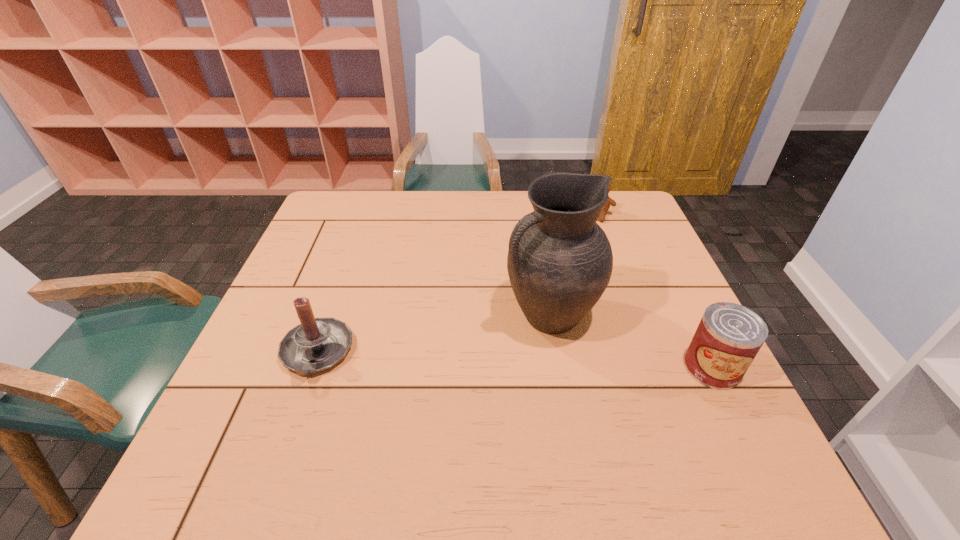
Locate an element on the screen. This screenshot has height=540, width=960. free spot between the farthest object and the rightmost object is located at coordinates (655, 292).

Find the location of `free point between the candle and the pitcher`. free point between the candle and the pitcher is located at coordinates (434, 334).

In order to click on vacant space in between the candle and the pitcher in this screenshot , I will do `click(434, 334)`.

Locate an element on the screen. This screenshot has width=960, height=540. vacant point located between the can and the shortest object is located at coordinates (655, 292).

Locate an element on the screen. The image size is (960, 540). object that stands as the third closest to the third object from left to right is located at coordinates (316, 344).

Point out which object is positioned as the nearest to the candle. Please provide its 2D coordinates. Your answer should be formatted as a tuple, i.e. [(x, y)], where the tuple contains the x and y coordinates of a point satisfying the conditions above.

[(560, 261)]

The width and height of the screenshot is (960, 540). What are the coordinates of `vacant space that satisfies the following two spatial constraints: 1. on the side of the rightmost object with the handle loop; 2. on the left side of the leftmost object` in the screenshot? It's located at (x=311, y=368).

Locate an element on the screen. vacant space that satisfies the following two spatial constraints: 1. on the front side of the can; 2. on the right side of the third object from left to right is located at coordinates (655, 368).